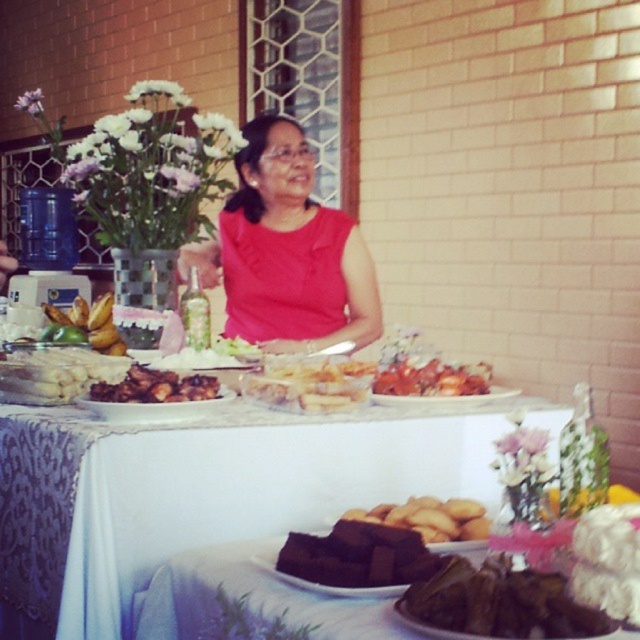
Is point (252, 186) less distant than point (84, 307)?

No, it is behind (84, 307).

Between point (276, 324) and point (60, 310), which one is positioned in front?

Point (60, 310) is in front.

Which is behind, point (282, 180) or point (106, 346)?

The point (282, 180) is more distant.

I want to click on matte red blouse at center, so click(285, 252).

Who is positioned more to the right, green matte bananas at center or white creamy cake at center?

white creamy cake at center is more to the right.

Is green matte bananas at center smaller than white creamy cake at center?

No, green matte bananas at center is not smaller than white creamy cake at center.

Between point (113, 324) and point (248, 358), which one is positioned in front?

Positioned in front is point (248, 358).

This screenshot has width=640, height=640. Find the location of `green matte bananas at center`. green matte bananas at center is located at coordinates (90, 323).

Is point (1, 387) closer to viewer compared to point (166, 362)?

That is True.

Between point (20, 362) and point (184, 369), which one is positioned in front?

Positioned in front is point (20, 362).

What are the coordinates of `white glossy cake at left` in the screenshot? It's located at (56, 374).